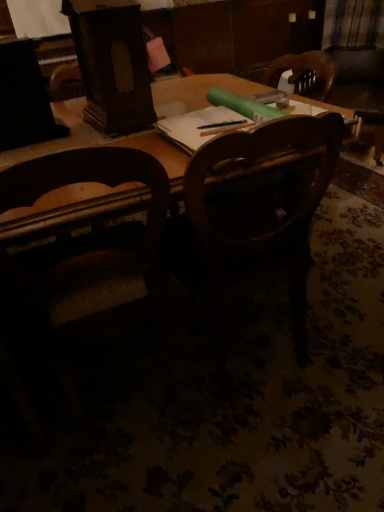
Question: Is wooden chair at center, the second chair from the left, taller than wooden chair at left, the first chair positioned from the left?

Choices:
 (A) no
 (B) yes

Answer: (A)

Question: Considering the relative positions of wooden chair at center, positioned as the first chair in right-to-left order, and wooden chair at left, the first chair positioned from the left, in the image provided, is wooden chair at center, positioned as the first chair in right-to-left order, in front of wooden chair at left, the first chair positioned from the left,?

Choices:
 (A) yes
 (B) no

Answer: (B)

Question: Is wooden chair at center, positioned as the first chair in right-to-left order, at the left side of wooden chair at left, the first chair positioned from the left?

Choices:
 (A) yes
 (B) no

Answer: (B)

Question: From a real-world perspective, is wooden chair at center, positioned as the first chair in right-to-left order, beneath wooden chair at left, the first chair positioned from the left?

Choices:
 (A) no
 (B) yes

Answer: (B)

Question: Is wooden chair at center, the second chair from the left, oriented away from wooden chair at left, the first chair positioned from the left?

Choices:
 (A) yes
 (B) no

Answer: (B)

Question: Relative to wooden chair at center, positioned as the first chair in right-to-left order, is plaid fabric at upper right in front or behind?

Choices:
 (A) behind
 (B) front

Answer: (A)

Question: Is plaid fabric at upper right wider or thinner than wooden chair at center, positioned as the first chair in right-to-left order?

Choices:
 (A) wide
 (B) thin

Answer: (B)

Question: From a real-world perspective, is plaid fabric at upper right physically located above or below wooden chair at center, the second chair from the left?

Choices:
 (A) above
 (B) below

Answer: (A)

Question: Is plaid fabric at upper right inside or outside of wooden chair at center, the second chair from the left?

Choices:
 (A) inside
 (B) outside

Answer: (B)

Question: Is point (324, 152) closer or farther from the camera than point (327, 33)?

Choices:
 (A) closer
 (B) farther

Answer: (A)

Question: Considering the positions of wooden chair at center, the second chair from the left, and plaid fabric at upper right in the image, is wooden chair at center, the second chair from the left, wider or thinner than plaid fabric at upper right?

Choices:
 (A) thin
 (B) wide

Answer: (B)

Question: Is wooden chair at center, the second chair from the left, spatially inside plaid fabric at upper right, or outside of it?

Choices:
 (A) outside
 (B) inside

Answer: (A)

Question: Is wooden chair at center, the second chair from the left, in front of or behind plaid fabric at upper right in the image?

Choices:
 (A) front
 (B) behind

Answer: (A)

Question: Considering their positions, is wooden chair at left, placed as the second chair when sorted from right to left, located in front of or behind plaid fabric at upper right?

Choices:
 (A) front
 (B) behind

Answer: (A)

Question: Based on their sizes in the image, would you say wooden chair at left, placed as the second chair when sorted from right to left, is bigger or smaller than plaid fabric at upper right?

Choices:
 (A) big
 (B) small

Answer: (A)